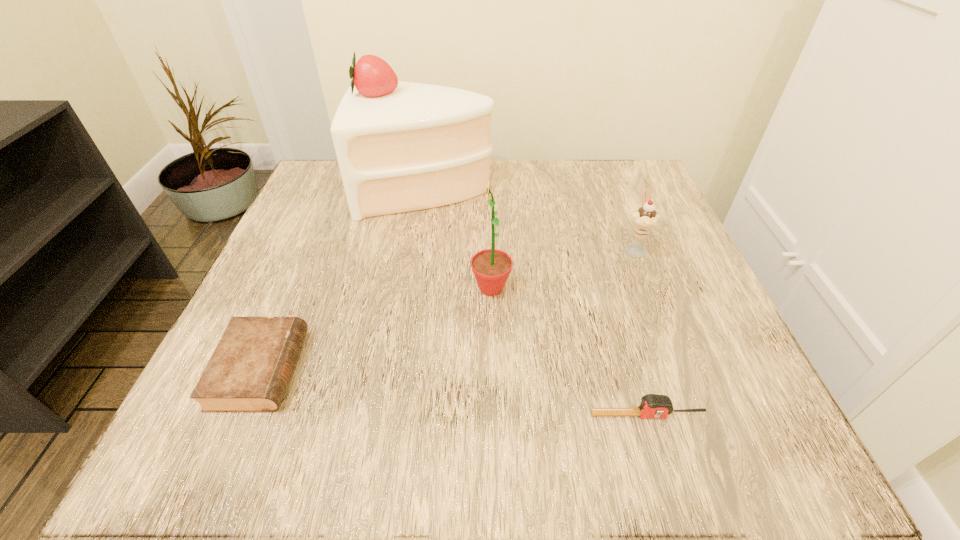
Find the location of a particular element. The height and width of the screenshot is (540, 960). icecream at the right edge is located at coordinates (644, 219).

Locate an element on the screen. tape measure situated at the right edge is located at coordinates (652, 405).

The width and height of the screenshot is (960, 540). In order to click on object at the far left corner in this screenshot , I will do `click(401, 146)`.

Locate an element on the screen. This screenshot has height=540, width=960. object located at the near left corner is located at coordinates (249, 371).

Where is `object situated at the near right corner`? The height and width of the screenshot is (540, 960). object situated at the near right corner is located at coordinates (652, 405).

You are a GUI agent. You are given a task and a screenshot of the screen. Output one action in this format:
    pyautogui.click(x=<x>, y=<y>)
    Task: Click on the free space at the far edge
    
    Given the screenshot: What is the action you would take?
    pyautogui.click(x=578, y=183)

This screenshot has width=960, height=540. I want to click on vacant region at the near edge of the desktop, so click(x=501, y=424).

Identify the location of vacant region at the left edge of the desktop. Image resolution: width=960 pixels, height=540 pixels. (324, 340).

In order to click on free space at the right edge of the desktop in this screenshot , I will do `click(741, 357)`.

You are a GUI agent. You are given a task and a screenshot of the screen. Output one action in this format:
    pyautogui.click(x=<x>, y=<y>)
    Task: Click on the vacant space at the far right corner of the desktop
    The height and width of the screenshot is (540, 960).
    Given the screenshot: What is the action you would take?
    pyautogui.click(x=603, y=163)